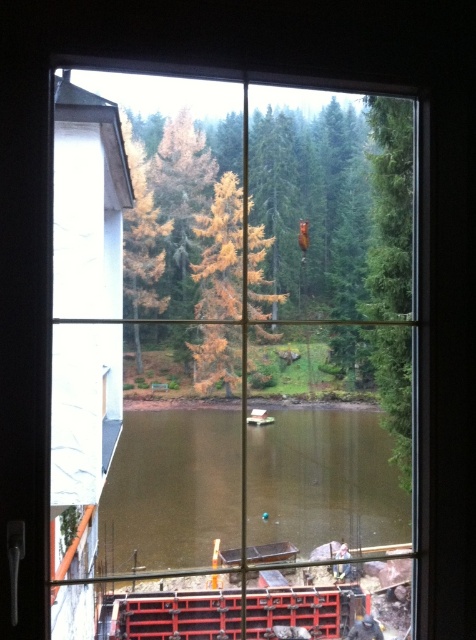
Looking at this image, you are standing in a room and want to look through the transparent glass window at center to see the outside. Where should you position yourself to ensure you can see the entire window without obstruction?

You should position yourself directly in front of the transparent glass window at center, ideally at its central point, to ensure an unobstructed view of the entire window.

Consider the image. You are standing in a room with a window. There is a point marked at coordinates (229, 353). Based on the scene description, what object is located at that point?

The point at coordinates (229, 353) indicates the transparent glass window at center.